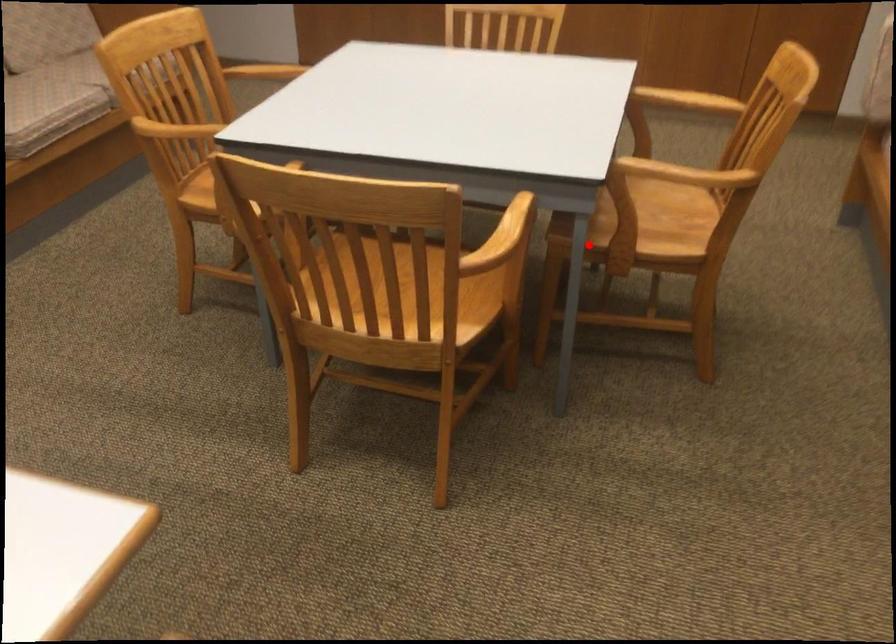
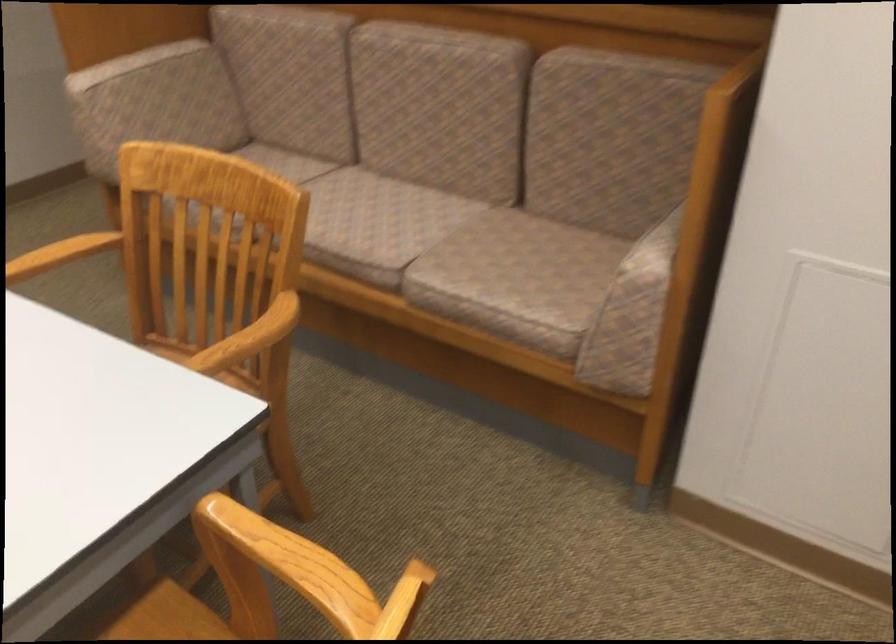
Question: I am providing you with two images of the same scene from different viewpoints. In image1, a red point is highlighted. Considering the same 3D point in image2, which of the following is correct?

Choices:
 (A) It is closer
 (B) It is farther

Answer: (A)